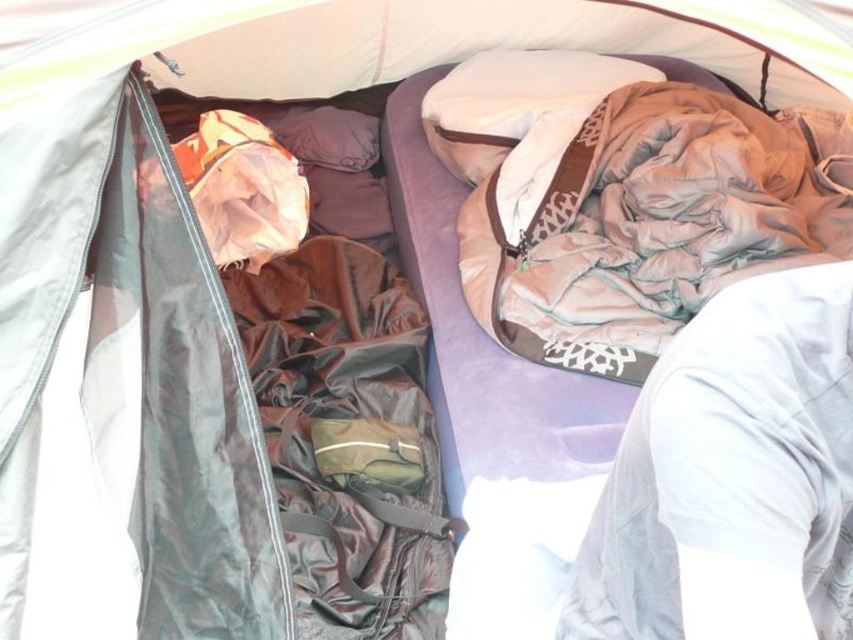
Does brown/cotton-blend blanket at upper right have a greater width compared to white soft pillow at upper center?

Yes.

Is brown/cotton-blend blanket at upper right thinner than white soft pillow at upper center?

In fact, brown/cotton-blend blanket at upper right might be wider than white soft pillow at upper center.

Which is behind, point (514, 301) or point (440, 148)?

The point (440, 148) is more distant.

Image resolution: width=853 pixels, height=640 pixels. Identify the location of brown/cotton-blend blanket at upper right. (654, 224).

Consider the image. Does white fabric at lower right appear over white soft pillow at upper center?

No, white fabric at lower right is not above white soft pillow at upper center.

Can you confirm if white fabric at lower right is positioned to the left of white soft pillow at upper center?

In fact, white fabric at lower right is to the right of white soft pillow at upper center.

In order to click on white fabric at lower right in this screenshot , I will do `click(730, 476)`.

Identify the location of white fabric at lower right. The width and height of the screenshot is (853, 640). (730, 476).

The image size is (853, 640). I want to click on brown/cotton-blend blanket at upper right, so click(654, 224).

Locate an element on the screen. brown/cotton-blend blanket at upper right is located at coordinates (654, 224).

Where is `brown/cotton-blend blanket at upper right`? brown/cotton-blend blanket at upper right is located at coordinates (654, 224).